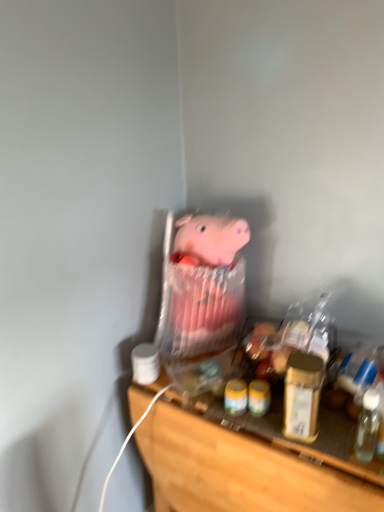
I want to click on vacant space situated above wooden shelf at lower center (from a real-world perspective), so click(x=280, y=401).